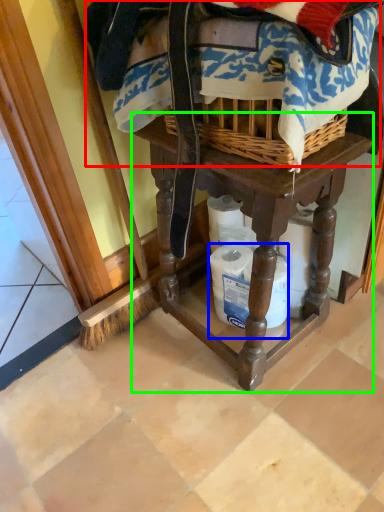
Question: Estimate the real-world distances between objects in this image. Which object is farther from clothing (highlighted by a red box), toilet paper (highlighted by a blue box) or furniture (highlighted by a green box)?

Choices:
 (A) toilet paper
 (B) furniture

Answer: (A)